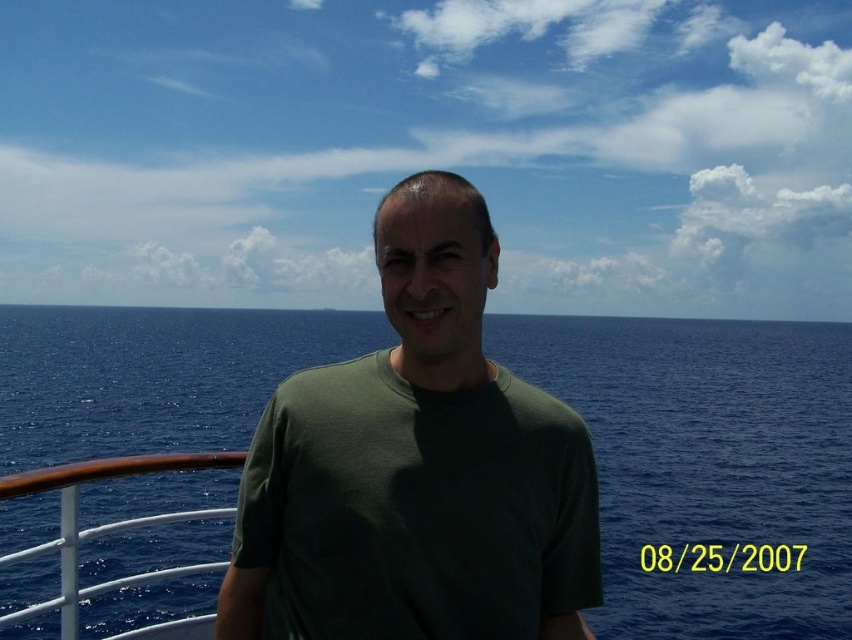
You are a photographer adjusting your camera to focus on two points in the scene. The first point is at coordinates point (x=75, y=326) and the second is at point (x=496, y=369). Which point should you focus on first if you want to ensure the closest object is in sharp focus?

Point (x=75, y=326) is further to the camera than point (x=496, y=369), so you should focus on point (x=75, y=326) first to ensure the closest object is in sharp focus.